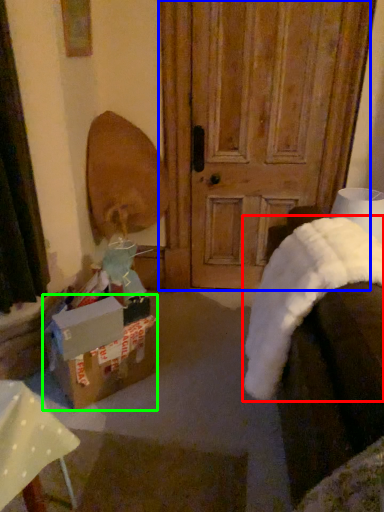
Question: Based on their relative distances, which object is nearer to blanket (highlighted by a red box)? Choose from door (highlighted by a blue box) and box (highlighted by a green box).

Choices:
 (A) door
 (B) box

Answer: (B)